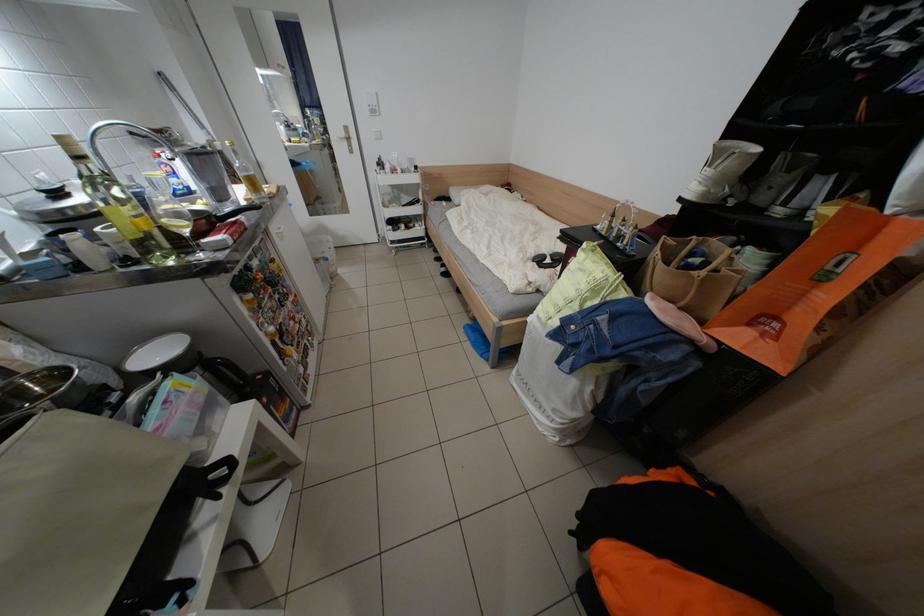
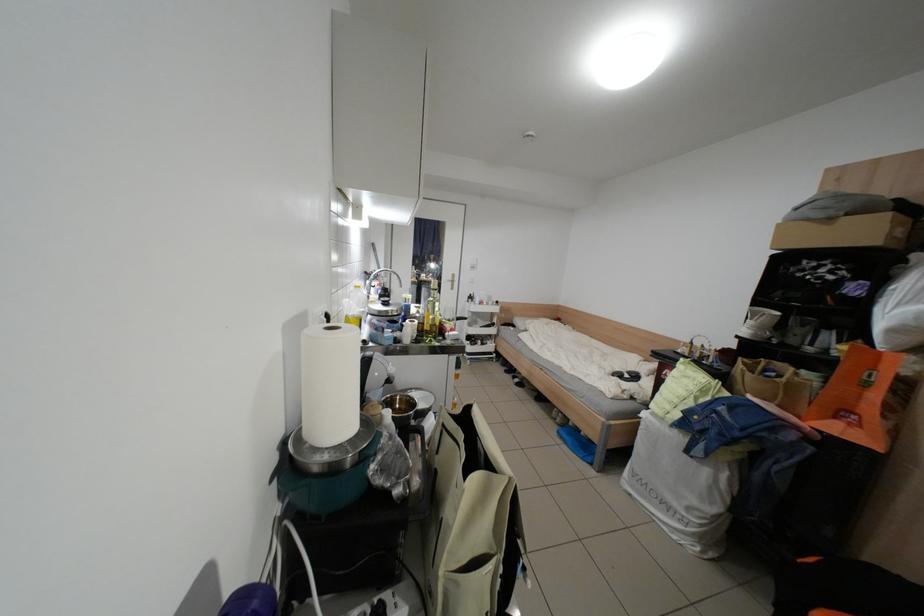
From the picture: In a continuous first-person perspective shot, in which direction is the camera moving?

The cameraman moved toward left, backward.